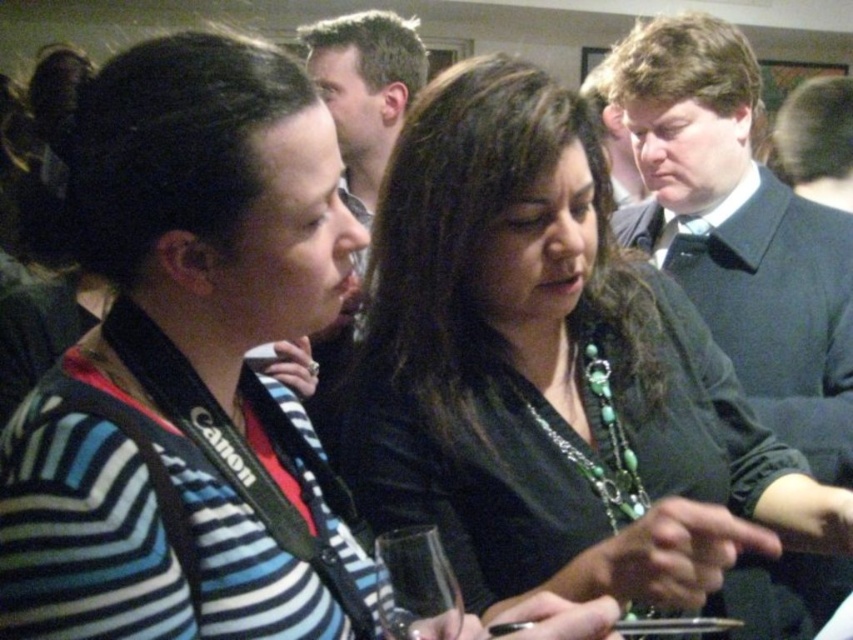
Question: Is striped sweater at center in front of green beaded necklace at center?

Choices:
 (A) no
 (B) yes

Answer: (B)

Question: Which of the following is the farthest from the observer?

Choices:
 (A) transparent glass at center
 (B) dark blue suit at center
 (C) green beaded necklace at center

Answer: (B)

Question: Considering the relative positions of striped sweater at center and transparent glass at center in the image provided, where is striped sweater at center located with respect to transparent glass at center?

Choices:
 (A) below
 (B) above

Answer: (B)

Question: Can you confirm if green beaded necklace at center is wider than dark blue suit at center?

Choices:
 (A) yes
 (B) no

Answer: (A)

Question: Considering the real-world distances, which object is farthest from the striped sweater at center?

Choices:
 (A) dark blue suit at center
 (B) green beaded necklace at center
 (C) transparent glass at center

Answer: (A)

Question: Estimate the real-world distances between objects in this image. Which object is farther from the transparent glass at center?

Choices:
 (A) dark blue suit at center
 (B) green beaded necklace at center

Answer: (A)